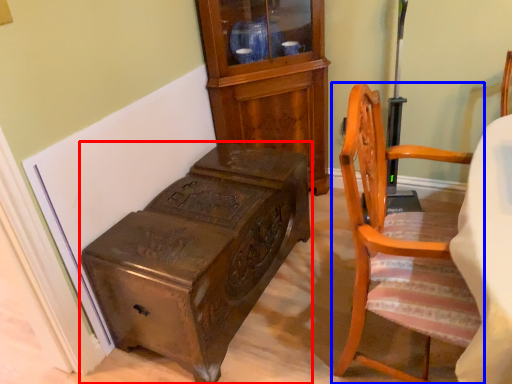
Question: Which point is further to the camera, furniture (highlighted by a red box) or chair (highlighted by a blue box)?

Choices:
 (A) furniture
 (B) chair

Answer: (A)